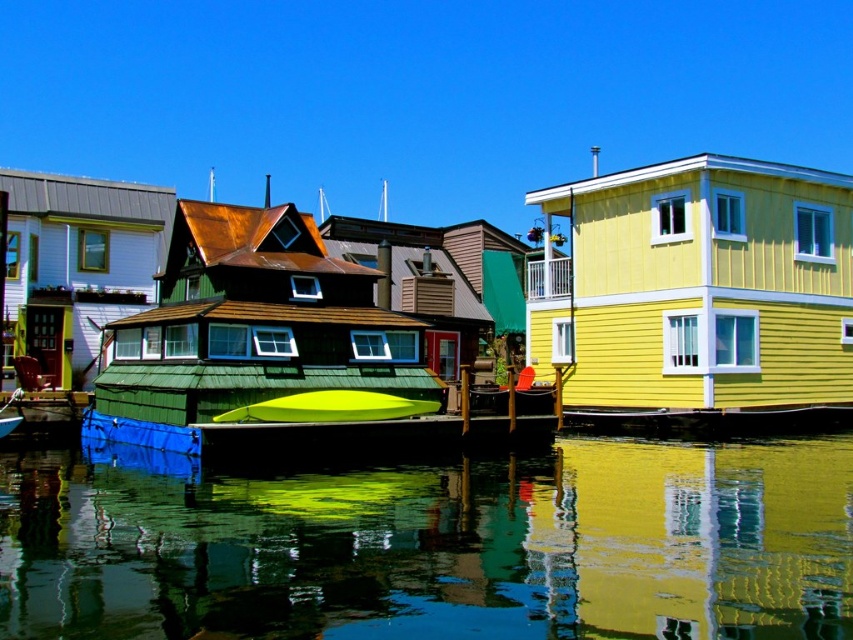
Question: In this image, where is green reflective water at center located relative to green matte kayak at center?

Choices:
 (A) left
 (B) right

Answer: (B)

Question: Is green reflective water at center to the left of green matte kayak at center from the viewer's perspective?

Choices:
 (A) no
 (B) yes

Answer: (A)

Question: Which point is farther from the camera taking this photo?

Choices:
 (A) (376, 401)
 (B) (502, 630)

Answer: (A)

Question: Which point is farther to the camera?

Choices:
 (A) green matte kayak at center
 (B) green reflective water at center

Answer: (A)

Question: Considering the relative positions of green reflective water at center and green matte kayak at center in the image provided, where is green reflective water at center located with respect to green matte kayak at center?

Choices:
 (A) below
 (B) above

Answer: (A)